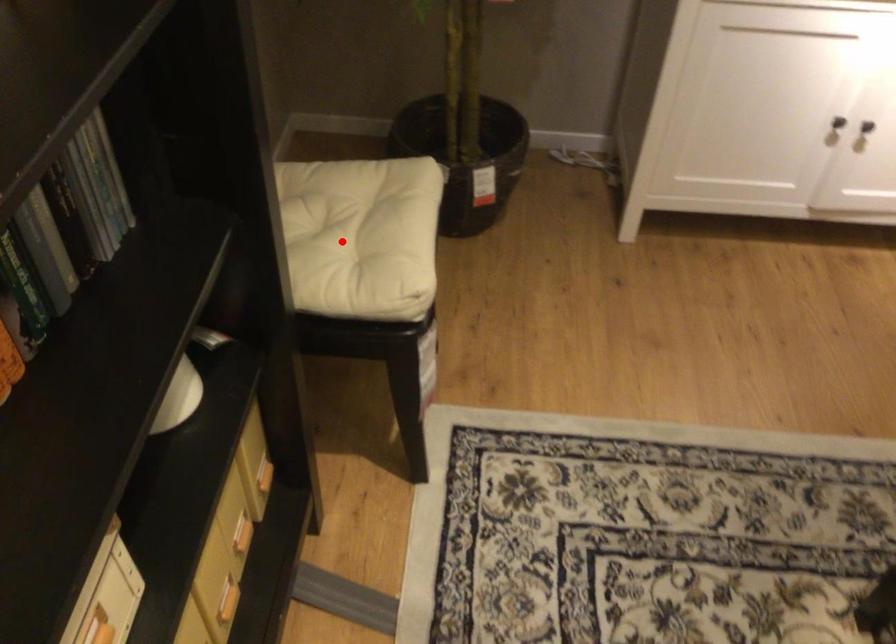
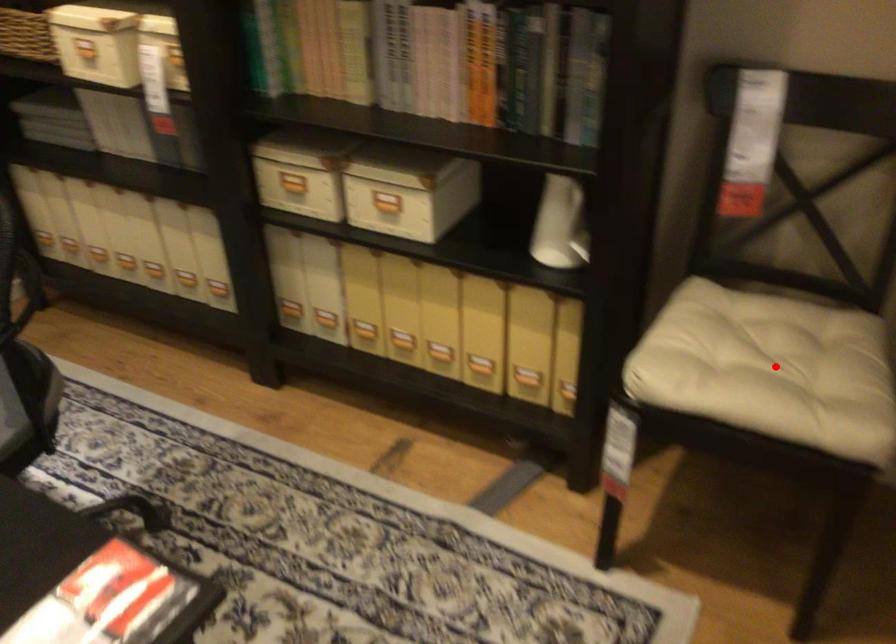
I am providing you with two images of the same scene from different viewpoints. A red point is marked on the first image and another point is marked on the second image. Is the red point in image1 aligned with the point shown in image2?

Yes